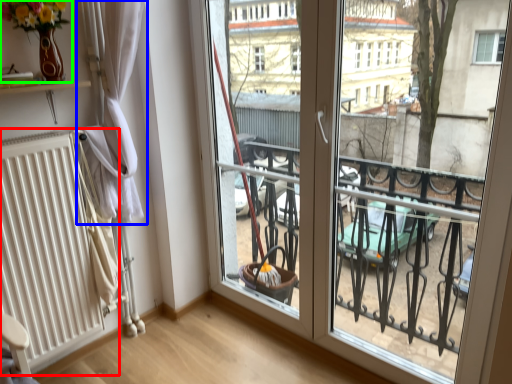
Question: Which is nearer to the radiator (highlighted by a red box)? curtain (highlighted by a blue box) or floral arrangement (highlighted by a green box).

Choices:
 (A) curtain
 (B) floral arrangement

Answer: (A)